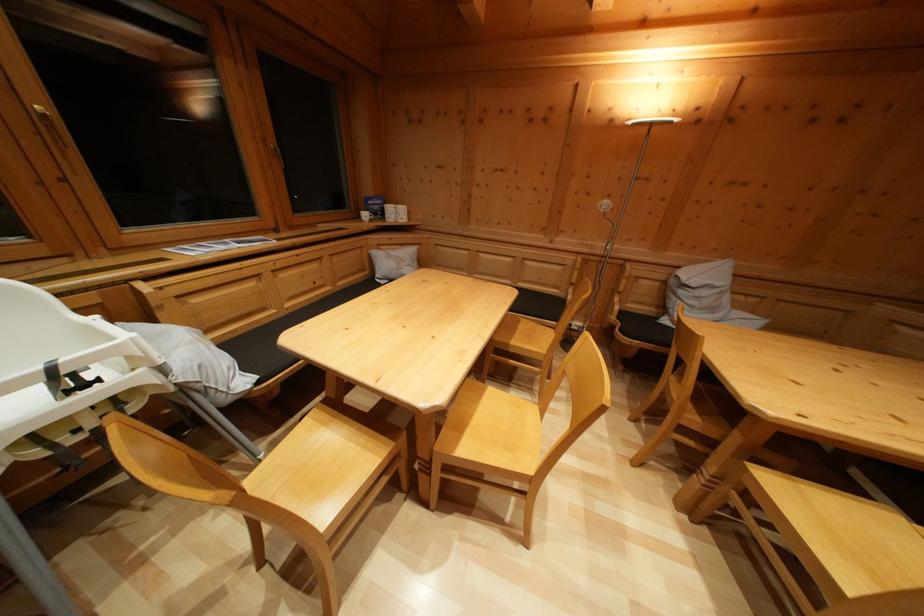
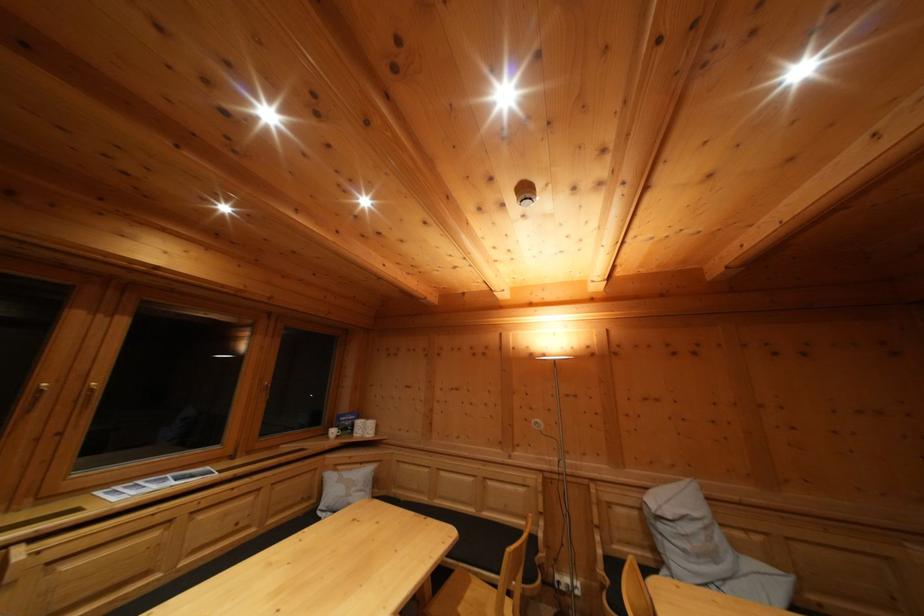
Locate, in the second image, the point that corresponds to point 407,252 in the first image.

(368, 469)